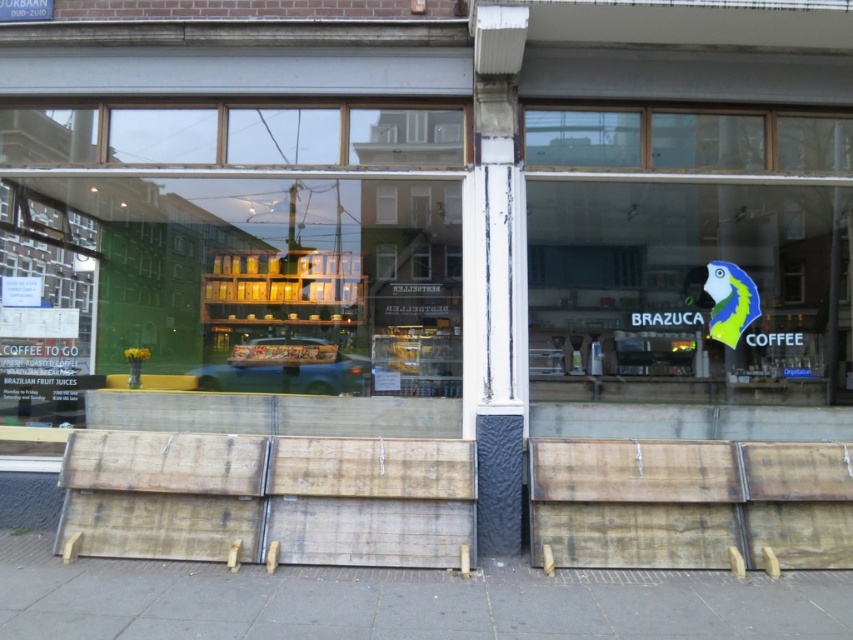
Is gray concrete pavement at lower center taller than green matte parrot at right?

Incorrect, gray concrete pavement at lower center's height is not larger of green matte parrot at right's.

Between gray concrete pavement at lower center and green matte parrot at right, which one appears on the right side from the viewer's perspective?

green matte parrot at right

Who is more forward, (62, 624) or (741, 288)?

Point (62, 624) is more forward.

Identify the location of gray concrete pavement at lower center. The image size is (853, 640). (401, 602).

Does transparent glass shop window at center come behind metallic silver car at center?

That is False.

Is point (368, 132) positioned in front of point (277, 352)?

Yes, point (368, 132) is in front of point (277, 352).

Is point (1, 369) positioned behind point (350, 376)?

No, it is not.

Image resolution: width=853 pixels, height=640 pixels. I want to click on transparent glass shop window at center, so click(231, 304).

Does transparent glass window at upper center have a lesser width compared to green matte parrot at right?

In fact, transparent glass window at upper center might be wider than green matte parrot at right.

Is point (809, 170) positioned in front of point (753, 305)?

Yes, it is.

What do you see at coordinates (686, 140) in the screenshot? I see `transparent glass window at upper center` at bounding box center [686, 140].

The width and height of the screenshot is (853, 640). What are the coordinates of `transparent glass window at upper center` in the screenshot? It's located at (686, 140).